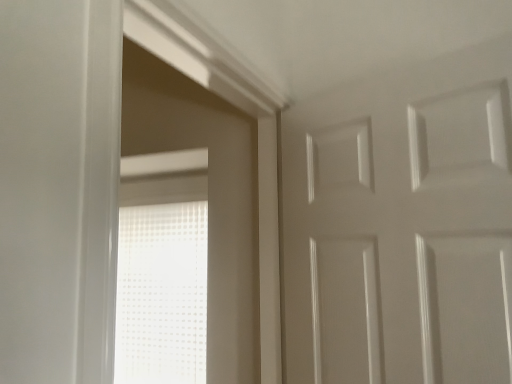
Question: From the image's perspective, is white glossy door at upper right above white frosted glass window at center?

Choices:
 (A) yes
 (B) no

Answer: (A)

Question: Is white glossy door at upper right far away from white frosted glass window at center?

Choices:
 (A) no
 (B) yes

Answer: (A)

Question: Considering the relative sizes of white glossy door at upper right and white frosted glass window at center in the image provided, is white glossy door at upper right smaller than white frosted glass window at center?

Choices:
 (A) no
 (B) yes

Answer: (A)

Question: Is the depth of white glossy door at upper right greater than that of white frosted glass window at center?

Choices:
 (A) yes
 (B) no

Answer: (B)

Question: Does white glossy door at upper right touch white frosted glass window at center?

Choices:
 (A) yes
 (B) no

Answer: (B)

Question: Is white frosted glass window at center at the back of white glossy door at upper right?

Choices:
 (A) no
 (B) yes

Answer: (A)

Question: From a real-world perspective, is white frosted glass window at center physically below white glossy door at upper right?

Choices:
 (A) yes
 (B) no

Answer: (A)

Question: Does white frosted glass window at center appear on the right side of white glossy door at upper right?

Choices:
 (A) yes
 (B) no

Answer: (B)

Question: From a real-world perspective, is white frosted glass window at center over white glossy door at upper right?

Choices:
 (A) no
 (B) yes

Answer: (A)

Question: Can we say white frosted glass window at center lies outside white glossy door at upper right?

Choices:
 (A) yes
 (B) no

Answer: (A)

Question: From the image's perspective, is white frosted glass window at center over white glossy door at upper right?

Choices:
 (A) no
 (B) yes

Answer: (A)

Question: Does white frosted glass window at center lie behind white glossy door at upper right?

Choices:
 (A) no
 (B) yes

Answer: (B)

Question: Is point (424, 147) closer or farther from the camera than point (202, 339)?

Choices:
 (A) farther
 (B) closer

Answer: (B)